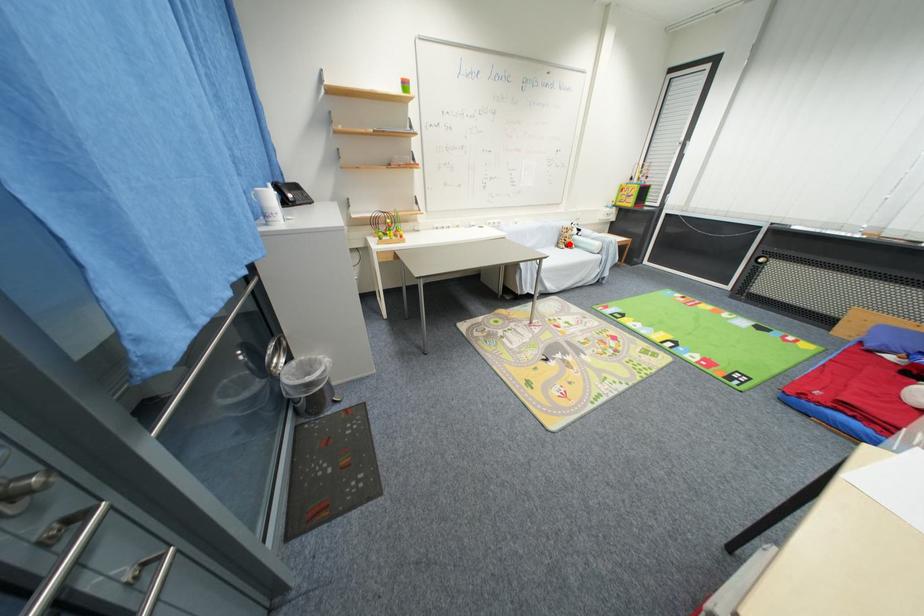
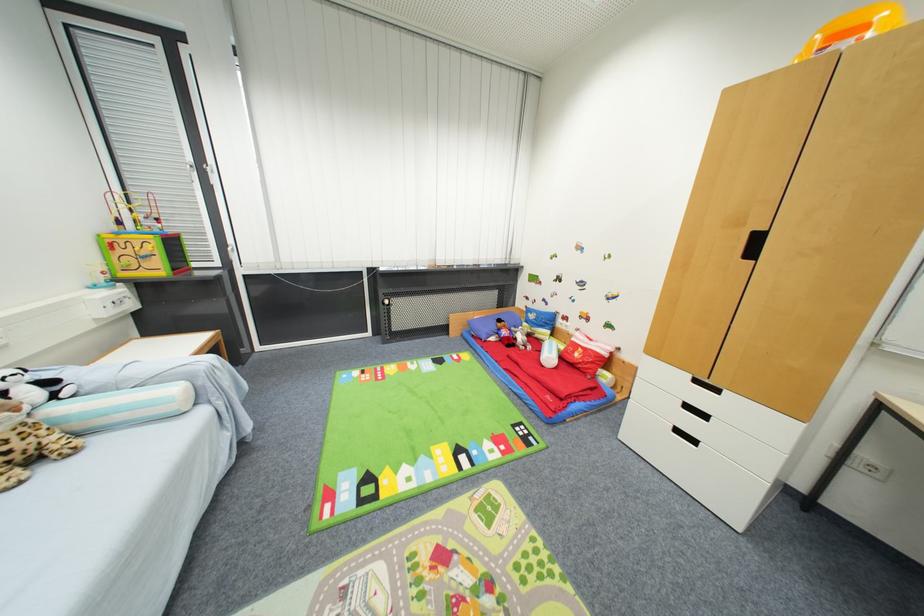
In the second image, find the point that corresponds to the highlighted location in the first image.

(7, 456)